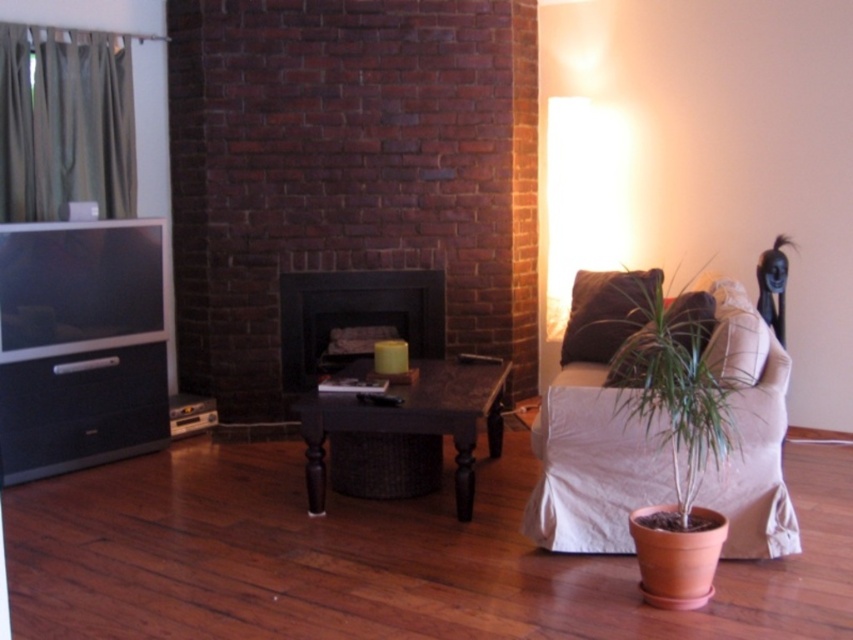
Looking at this image, you are standing in the living room and want to place a small decorative item on the green matte plant at lower right. According to the image, where exactly should you place it?

The green matte plant at lower right is located at point (659, 368), so you should place the decorative item at those coordinates.

You are a delivery person who needs to place a package that is 3 feet long on the floor between the brown wicker table at center and the matte black fireplace at center. Is there enough space between them to place the package horizontally?

The brown wicker table at center is 3.38 feet from the matte black fireplace at center, so yes, the package can be placed horizontally between them since the distance is greater than the package length.

You are arranging flowers in the living room. You have a green matte plant at lower right and a brown wicker table at center. Which object is closer to you if you are standing in front of the fireplace?

The green matte plant at lower right is closer to you because it is in front of the brown wicker table at center.